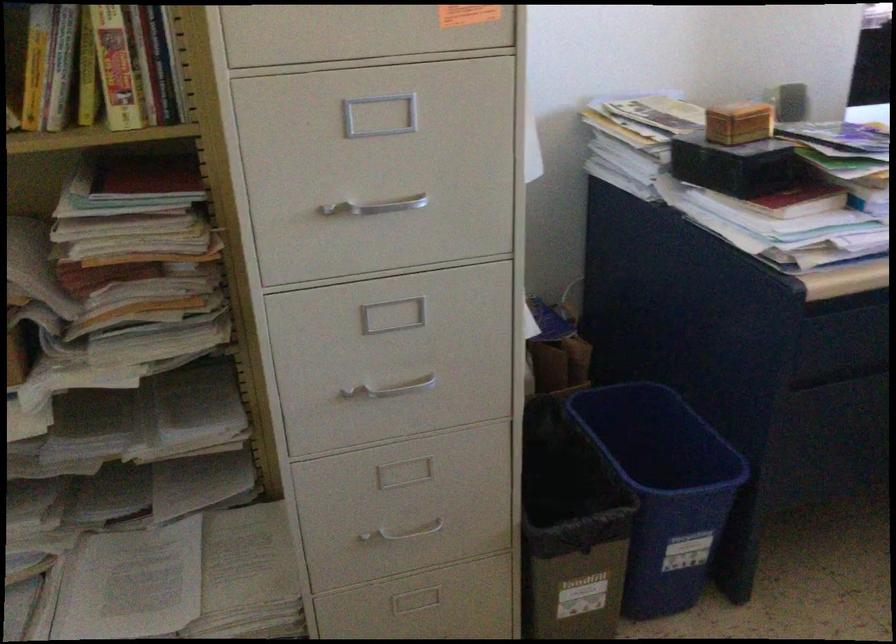
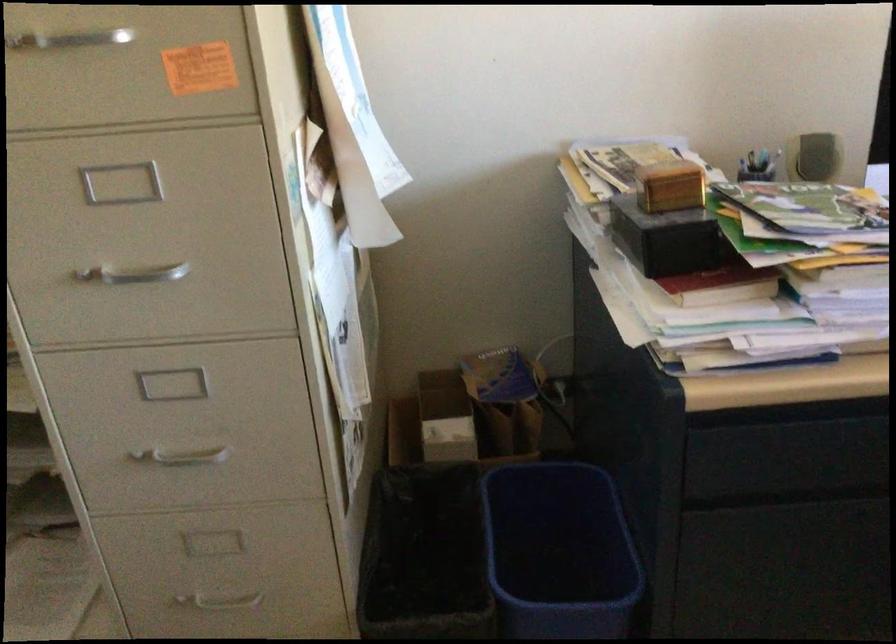
Find the pixel in the second image that matches point 371,212 in the first image.

(134, 274)